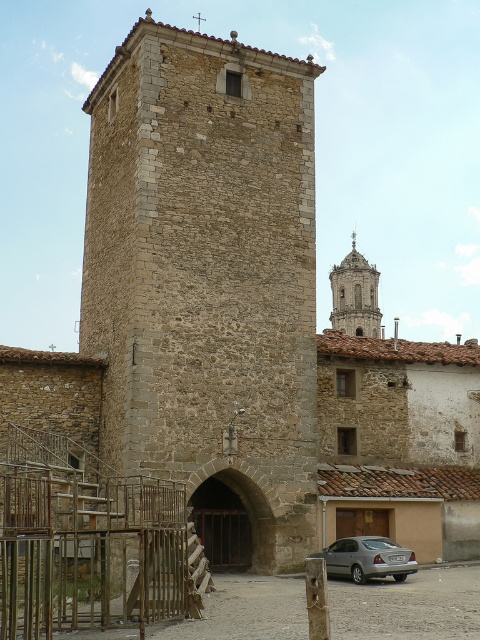
Question: Can you confirm if smooth stone bell tower at upper center is wider than satin silver sedan at lower right?

Choices:
 (A) no
 (B) yes

Answer: (B)

Question: Which object is closer to the camera taking this photo?

Choices:
 (A) smooth stone bell tower at upper center
 (B) brown stone tower at center
 (C) brown wooden door at center
 (D) satin silver sedan at lower right

Answer: (B)

Question: Does satin silver sedan at lower right lie behind brown wooden door at center?

Choices:
 (A) no
 (B) yes

Answer: (A)

Question: Can you confirm if brown stone tower at center is smaller than brown wooden door at center?

Choices:
 (A) no
 (B) yes

Answer: (A)

Question: Which point is closer to the camera taking this photo?

Choices:
 (A) (360, 522)
 (B) (183, 40)

Answer: (B)

Question: Which point appears farthest from the camera in this image?

Choices:
 (A) (372, 323)
 (B) (271, 172)

Answer: (A)